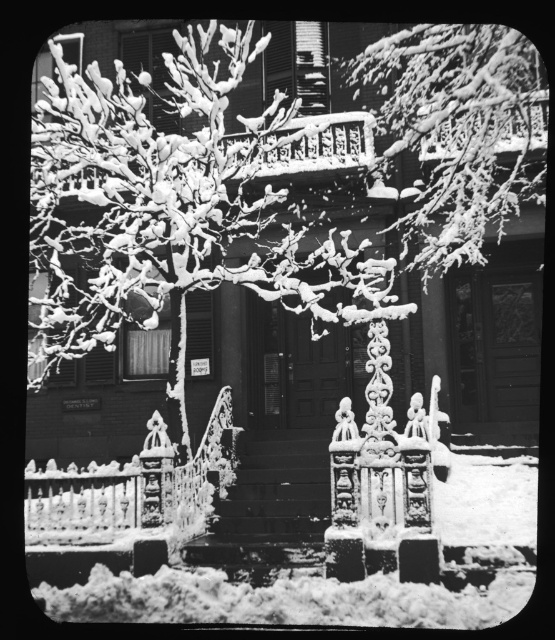
Question: Which is nearer to the snow-covered branches at upper center?

Choices:
 (A) white fluffy snow at lower center
 (B) snow-covered wrought iron fence at center

Answer: (B)

Question: Considering the relative positions of white fluffy snow at lower center and snow-covered wrought iron fence at center in the image provided, where is white fluffy snow at lower center located with respect to snow-covered wrought iron fence at center?

Choices:
 (A) left
 (B) right

Answer: (B)

Question: Does white fluffy snow at lower center appear under snow-covered wrought iron fence at center?

Choices:
 (A) yes
 (B) no

Answer: (A)

Question: Does snow-covered branches at upper center appear on the left side of snow-covered wrought iron fence at center?

Choices:
 (A) yes
 (B) no

Answer: (B)

Question: Among these points, which one is nearest to the camera?

Choices:
 (A) (118, 516)
 (B) (384, 67)

Answer: (A)

Question: Which of the following is the closest to the observer?

Choices:
 (A) snow-covered wrought iron fence at center
 (B) white fluffy snow at lower center

Answer: (B)